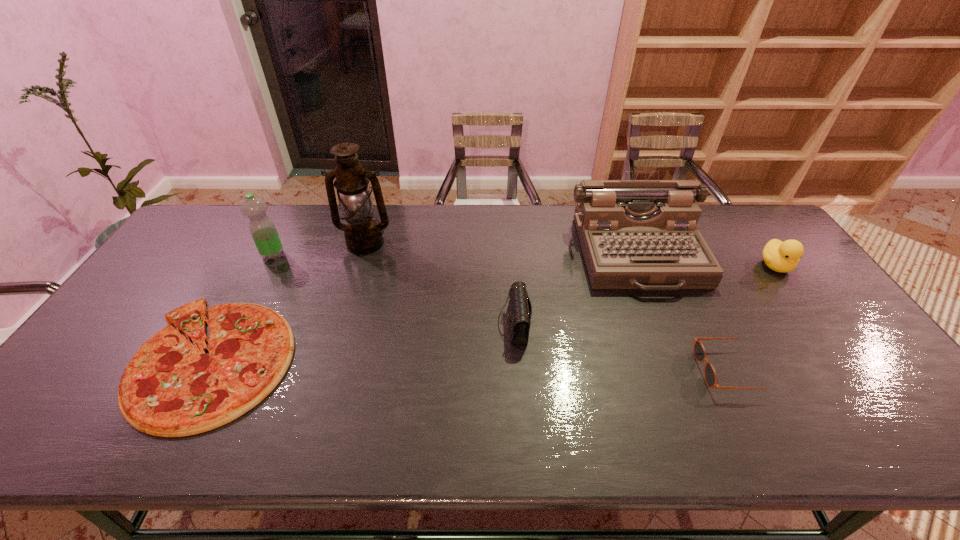
This screenshot has height=540, width=960. What are the coordinates of `free space that satisfies the following two spatial constraints: 1. on the front-facing side of the duck; 2. on the front flap of the fourth object from right to left` in the screenshot? It's located at (818, 325).

The width and height of the screenshot is (960, 540). In order to click on vacant space that satisfies the following two spatial constraints: 1. on the back side of the third object from left to right; 2. on the left side of the water bottle in this screenshot , I will do `click(279, 244)`.

In order to click on vacant space that satisfies the following two spatial constraints: 1. on the front-facing side of the rightmost object; 2. on the front-facing side of the second shortest object in this screenshot , I will do `click(852, 370)`.